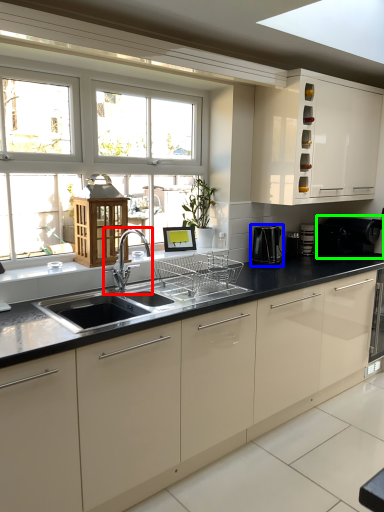
Question: Which object is the closest to the tap (highlighted by a red box)? Choose among these: coffee machine (highlighted by a blue box) or appliance (highlighted by a green box).

Choices:
 (A) coffee machine
 (B) appliance

Answer: (A)